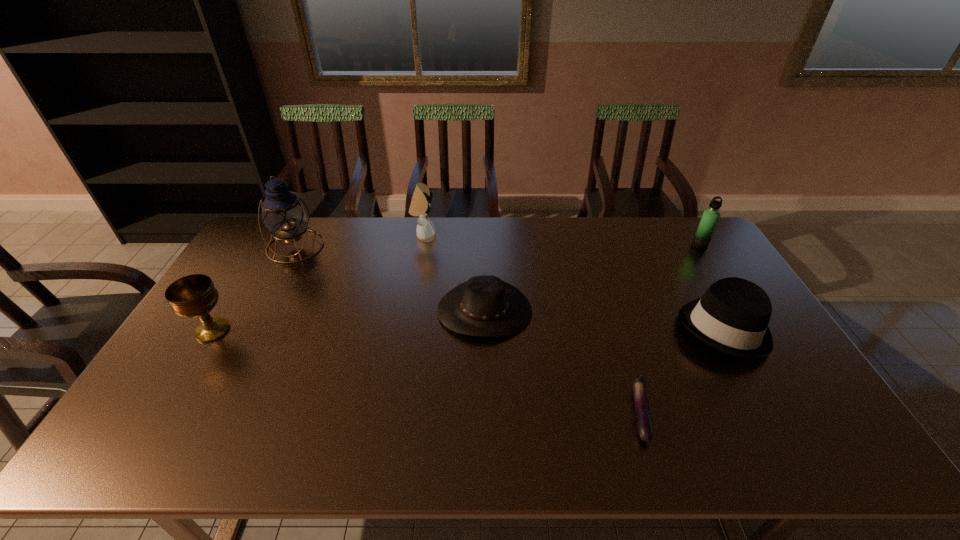
Select which object appears as the sixth closest to the fedora. Please provide its 2D coordinates. Your answer should be formatted as a tuple, i.e. [(x, y)], where the tuple contains the x and y coordinates of a point satisfying the conditions above.

[(194, 296)]

Locate an element on the screen. The height and width of the screenshot is (540, 960). the fourth closest object relative to the fedora is located at coordinates (420, 205).

This screenshot has width=960, height=540. I want to click on vacant space that satisfies the following two spatial constraints: 1. on the front-facing side of the fedora; 2. on the left side of the tallest object, so click(x=252, y=328).

In order to click on vacant position in the image that satisfies the following two spatial constraints: 1. at the front face of the thermos bottle; 2. on the left side of the doll in this screenshot , I will do `click(422, 245)`.

Where is `free region that satisfies the following two spatial constraints: 1. on the back side of the shortest object; 2. on the right side of the thermos bottle`? This screenshot has width=960, height=540. free region that satisfies the following two spatial constraints: 1. on the back side of the shortest object; 2. on the right side of the thermos bottle is located at coordinates (588, 245).

Locate an element on the screen. The width and height of the screenshot is (960, 540). free point that satisfies the following two spatial constraints: 1. at the front face of the doll; 2. on the front-facing side of the lantern is located at coordinates 421,246.